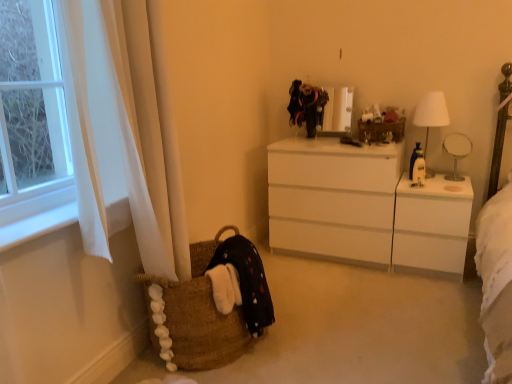
Question: Considering the relative positions of velvet black dress at upper center, which ranks as the second clothing in front-to-back order, and white glossy table lamp at right in the image provided, is velvet black dress at upper center, which ranks as the second clothing in front-to-back order, in front of white glossy table lamp at right?

Choices:
 (A) yes
 (B) no

Answer: (B)

Question: Is velvet black dress at upper center, acting as the 2th clothing starting from the left, shorter than white glossy table lamp at right?

Choices:
 (A) no
 (B) yes

Answer: (A)

Question: From the image's perspective, does velvet black dress at upper center, the first clothing viewed from the right, appear higher than white glossy table lamp at right?

Choices:
 (A) no
 (B) yes

Answer: (B)

Question: Can you confirm if velvet black dress at upper center, which ranks as the first clothing in top-to-bottom order, is positioned to the left of white glossy table lamp at right?

Choices:
 (A) yes
 (B) no

Answer: (A)

Question: Does velvet black dress at upper center, which ranks as the second clothing in front-to-back order, have a larger size compared to white glossy table lamp at right?

Choices:
 (A) no
 (B) yes

Answer: (A)

Question: Is velvet black dress at upper center, which ranks as the first clothing in top-to-bottom order, not inside white glossy table lamp at right?

Choices:
 (A) no
 (B) yes

Answer: (B)

Question: Is white glossy chest of drawers at center further to the viewer compared to black cotton dress at lower left, which ranks as the first clothing in bottom-to-top order?

Choices:
 (A) no
 (B) yes

Answer: (B)

Question: Does white glossy chest of drawers at center appear on the right side of black cotton dress at lower left, which is the second clothing in right-to-left order?

Choices:
 (A) no
 (B) yes

Answer: (B)

Question: From a real-world perspective, is white glossy chest of drawers at center on black cotton dress at lower left, which appears as the second clothing when viewed from the back?

Choices:
 (A) no
 (B) yes

Answer: (B)

Question: From the image's perspective, is white glossy chest of drawers at center on top of black cotton dress at lower left, which is the second clothing in right-to-left order?

Choices:
 (A) no
 (B) yes

Answer: (B)

Question: Is there a large distance between white glossy chest of drawers at center and black cotton dress at lower left, the first clothing when ordered from left to right?

Choices:
 (A) yes
 (B) no

Answer: (B)

Question: Is black cotton dress at lower left, which is the 1th clothing in front-to-back order, at the back of white glossy chest of drawers at center?

Choices:
 (A) no
 (B) yes

Answer: (A)

Question: Is there a large distance between velvet black dress at upper center, the first clothing viewed from the right, and white fabric lampshade at right?

Choices:
 (A) yes
 (B) no

Answer: (B)